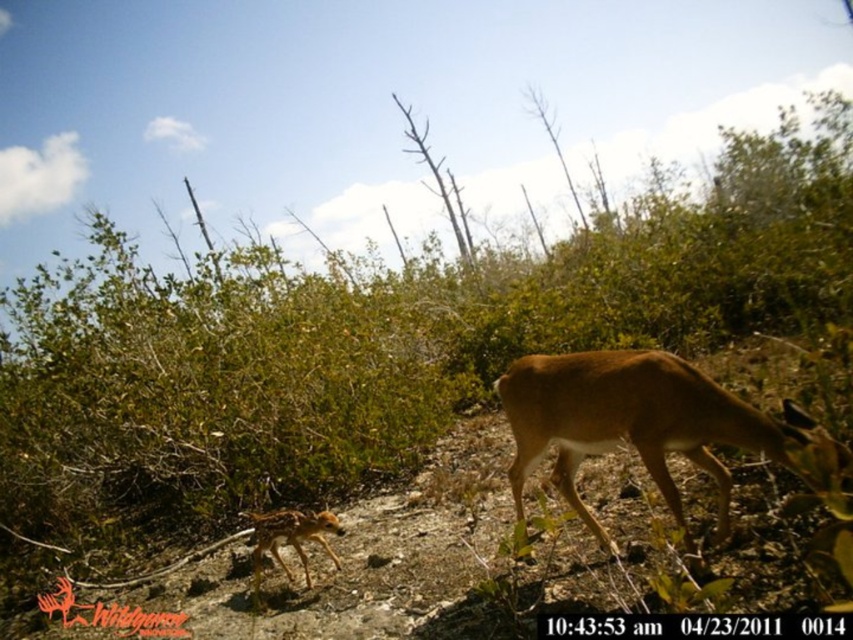
Is brown matte/deer at center closer to camera compared to spotted fur fawn at lower left?

Yes, it is.

Can you confirm if brown matte/deer at center is bigger than spotted fur fawn at lower left?

Yes, brown matte/deer at center is bigger than spotted fur fawn at lower left.

Locate an element on the screen. This screenshot has width=853, height=640. brown matte/deer at center is located at coordinates (631, 422).